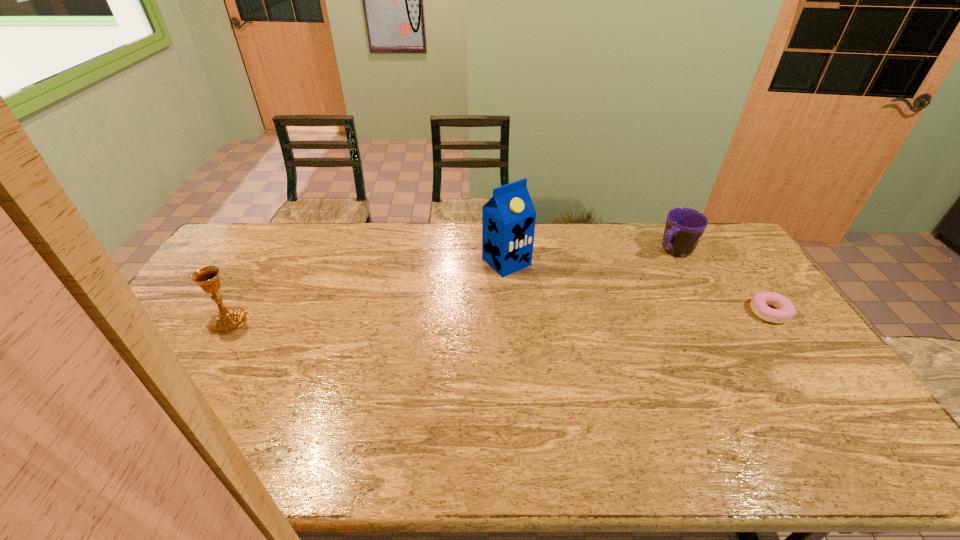
Locate an element on the screen. The width and height of the screenshot is (960, 540). free space between the pastry and the mug is located at coordinates (721, 281).

You are a GUI agent. You are given a task and a screenshot of the screen. Output one action in this format:
    pyautogui.click(x=<x>, y=<y>)
    Task: Click on the free spot between the leftmost object and the mug
    Image resolution: width=960 pixels, height=540 pixels.
    Given the screenshot: What is the action you would take?
    pyautogui.click(x=451, y=286)

The image size is (960, 540). I want to click on vacant area that lies between the third object from left to right and the pastry, so click(x=721, y=281).

This screenshot has height=540, width=960. In order to click on free space between the second object from left to right and the shortest object in this screenshot , I will do `click(637, 287)`.

Where is `empty space between the carton and the mug`? The image size is (960, 540). empty space between the carton and the mug is located at coordinates (589, 256).

Locate an element on the screen. free space between the pastry and the chalice is located at coordinates (499, 316).

Identify the location of vacant space that's between the carton and the rightmost object. Image resolution: width=960 pixels, height=540 pixels. (637, 287).

Locate which object is the third closest to the leftmost object. Please provide its 2D coordinates. Your answer should be formatted as a tuple, i.e. [(x, y)], where the tuple contains the x and y coordinates of a point satisfying the conditions above.

[(759, 303)]

Locate an element on the screen. This screenshot has width=960, height=540. object that stands as the second closest to the shortest object is located at coordinates (508, 219).

What are the coordinates of `vacant space that satisfies the following two spatial constraints: 1. on the front side of the pastry; 2. on the left side of the tallest object` in the screenshot? It's located at (510, 312).